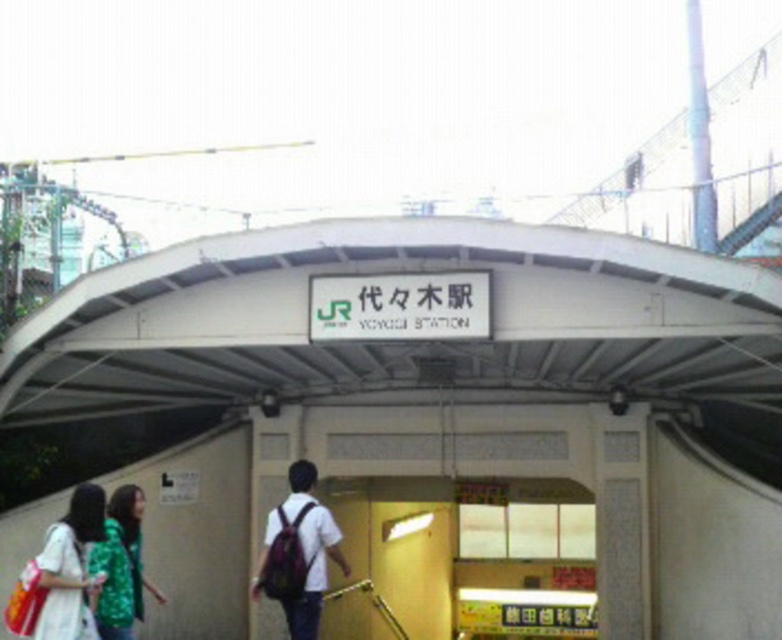
Question: Which point is closer to the camera?

Choices:
 (A) (85, 540)
 (B) (289, 512)

Answer: (A)

Question: From the image, what is the correct spatial relationship of white matte overpass at center in relation to green textured jacket at lower left?

Choices:
 (A) right
 (B) left

Answer: (A)

Question: Which object is positioned farthest from the white cotton dress at lower left?

Choices:
 (A) green textured jacket at lower left
 (B) matte white shirt with backpack at center
 (C) white matte overpass at center

Answer: (C)

Question: From the image, what is the correct spatial relationship of white matte overpass at center in relation to matte white shirt with backpack at center?

Choices:
 (A) above
 (B) below

Answer: (A)

Question: Can you confirm if white matte overpass at center is wider than matte white shirt with backpack at center?

Choices:
 (A) yes
 (B) no

Answer: (A)

Question: Which point is farther to the camera?

Choices:
 (A) (533, 372)
 (B) (74, 541)
 (C) (110, 637)

Answer: (A)